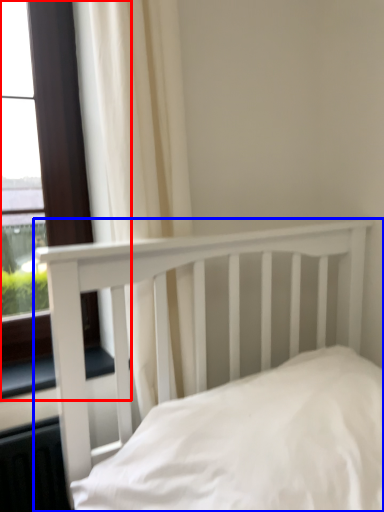
Question: Which object is closer to the camera taking this photo, window (highlighted by a red box) or bed (highlighted by a blue box)?

Choices:
 (A) window
 (B) bed

Answer: (B)